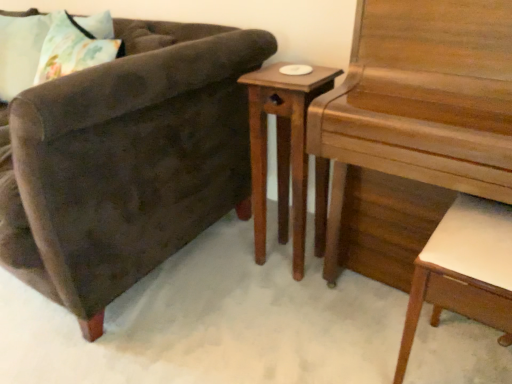
Question: Is point (415, 130) positioned closer to the camera than point (455, 297)?

Choices:
 (A) closer
 (B) farther

Answer: (B)

Question: In the image, is wooden piano at right positioned in front of or behind white leather desk at lower right?

Choices:
 (A) behind
 (B) front

Answer: (B)

Question: Estimate the real-world distances between objects in this image. Which object is closer to the fluffy fabric pillow at upper left?

Choices:
 (A) wooden nightstand at center
 (B) velvet brown armchair at left
 (C) white leather desk at lower right
 (D) wooden piano at right

Answer: (B)

Question: Which is farther from the fluffy fabric pillow at upper left?

Choices:
 (A) wooden nightstand at center
 (B) white leather desk at lower right
 (C) wooden piano at right
 (D) velvet brown armchair at left

Answer: (B)